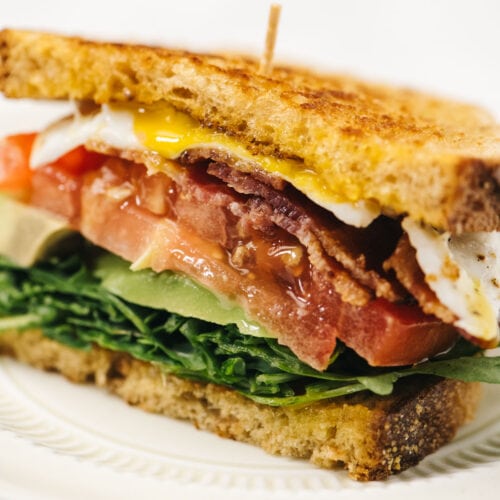
You are a GUI agent. You are given a task and a screenshot of the screen. Output one action in this format:
    pyautogui.click(x=<x>, y=<y>)
    Task: Click on the scalloped pattern on a white plate
    Image resolution: width=500 pixels, height=500 pixels.
    Given the screenshot: What is the action you would take?
    pyautogui.click(x=5, y=413), pyautogui.click(x=93, y=457), pyautogui.click(x=231, y=483), pyautogui.click(x=321, y=482), pyautogui.click(x=440, y=459), pyautogui.click(x=483, y=440)